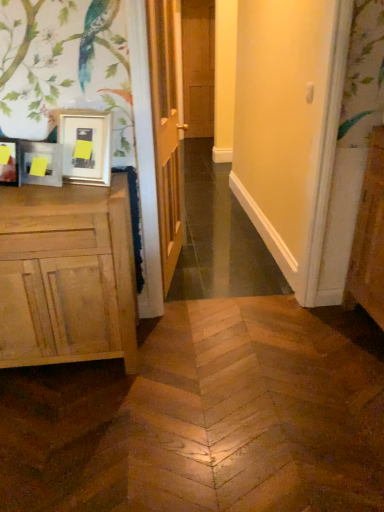
Question: Are wooden door at center, acting as the 1th door starting from the front, and brown wooden door at center, the 1th door viewed from the top, making contact?

Choices:
 (A) no
 (B) yes

Answer: (A)

Question: Can you confirm if wooden door at center, placed as the second door when sorted from top to bottom, is positioned to the left of brown wooden door at center, which is the second door in bottom-to-top order?

Choices:
 (A) no
 (B) yes

Answer: (B)

Question: Can you confirm if wooden door at center, acting as the 1th door starting from the front, is shorter than brown wooden door at center, marked as the 2th door in a front-to-back arrangement?

Choices:
 (A) no
 (B) yes

Answer: (B)

Question: Does wooden door at center, positioned as the 1th door in bottom-to-top order, have a smaller size compared to brown wooden door at center, which is the second door in bottom-to-top order?

Choices:
 (A) no
 (B) yes

Answer: (A)

Question: Can we say wooden door at center, positioned as the 1th door in bottom-to-top order, lies outside brown wooden door at center, which is the second door in bottom-to-top order?

Choices:
 (A) yes
 (B) no

Answer: (A)

Question: Considering the positions of point (59, 193) and point (294, 253), is point (59, 193) closer or farther from the camera than point (294, 253)?

Choices:
 (A) farther
 (B) closer

Answer: (B)

Question: Is natural wood cabinet at left bigger or smaller than matte wood screen door at center?

Choices:
 (A) small
 (B) big

Answer: (B)

Question: Considering the relative positions of natural wood cabinet at left and matte wood screen door at center in the image provided, is natural wood cabinet at left to the left or to the right of matte wood screen door at center?

Choices:
 (A) right
 (B) left

Answer: (B)

Question: From a real-world perspective, is natural wood cabinet at left positioned above or below matte wood screen door at center?

Choices:
 (A) above
 (B) below

Answer: (B)

Question: Does point [241, 64] appear closer or farther from the camera than point [52, 147]?

Choices:
 (A) farther
 (B) closer

Answer: (A)

Question: Considering their positions, is matte wood screen door at center located in front of or behind matte wooden picture frame at left?

Choices:
 (A) behind
 (B) front

Answer: (B)

Question: Considering the positions of matte wood screen door at center and matte wooden picture frame at left in the image, is matte wood screen door at center taller or shorter than matte wooden picture frame at left?

Choices:
 (A) tall
 (B) short

Answer: (A)

Question: Choose the correct answer: Is matte wood screen door at center inside matte wooden picture frame at left or outside it?

Choices:
 (A) outside
 (B) inside

Answer: (A)

Question: Is matte wooden picture frame at left wider or thinner than wooden door at center, positioned as the 1th door in bottom-to-top order?

Choices:
 (A) wide
 (B) thin

Answer: (B)

Question: Considering the positions of matte wooden picture frame at left and wooden door at center, positioned as the 1th door in bottom-to-top order, in the image, is matte wooden picture frame at left taller or shorter than wooden door at center, positioned as the 1th door in bottom-to-top order,?

Choices:
 (A) tall
 (B) short

Answer: (B)